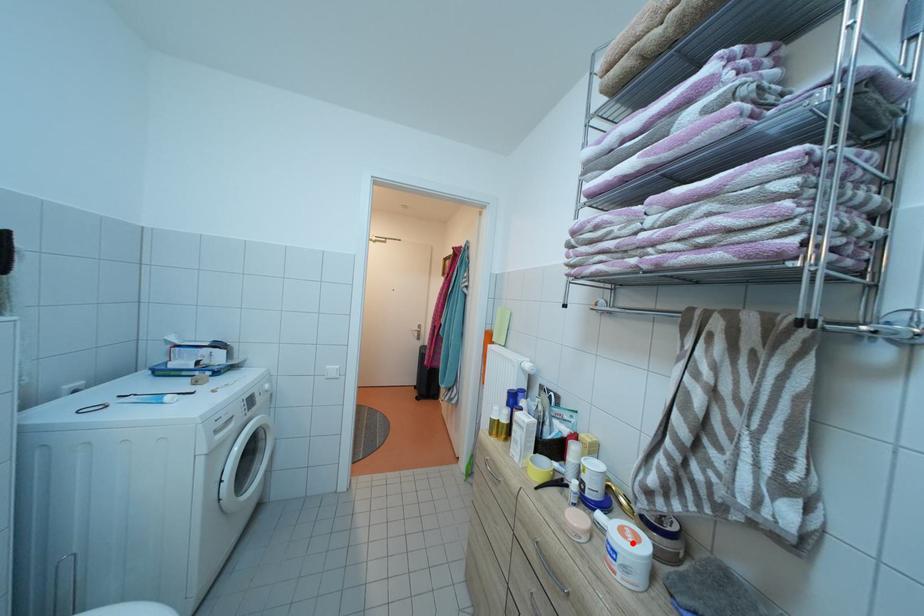
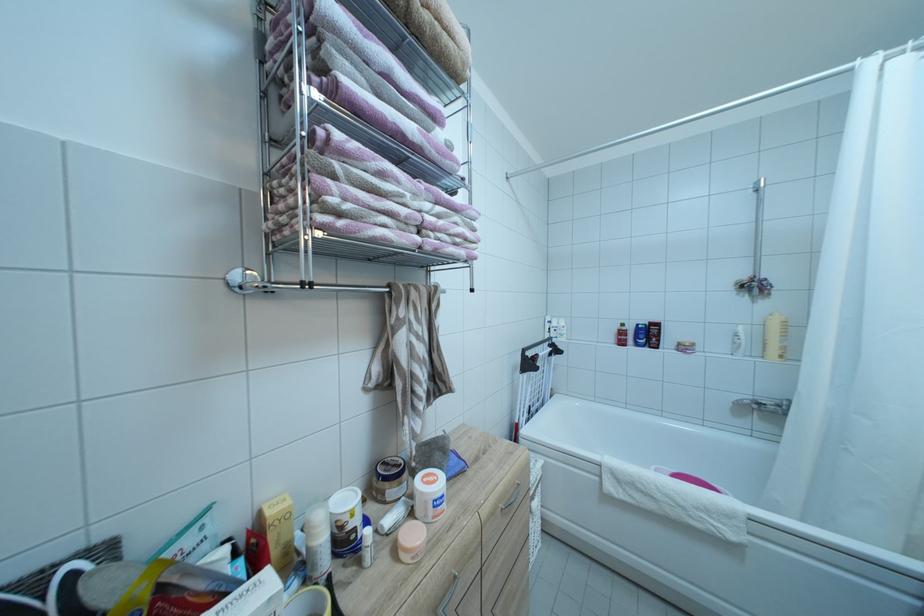
In the second image, find the point that corresponds to the highlighted location in the first image.

(442, 487)